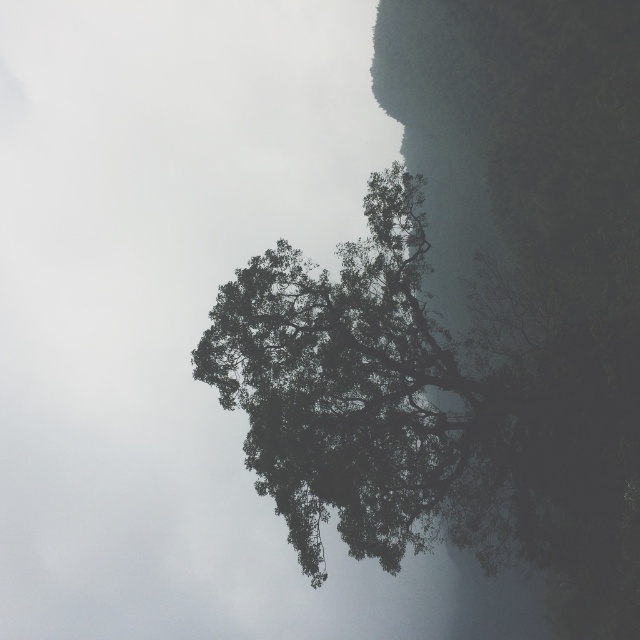
You are a hiker trying to navigate through the misty area. You see the dark green textured cliff at center and the dark green leafy tree at center. Which one is positioned to the right of the other?

The dark green textured cliff at center is to the right of the dark green leafy tree at center.

You are a hiker trying to reach the dark green leafy tree at center from the dark green textured cliff at center. Which direction should you move to get closer to the tree?

The dark green textured cliff at center is closer to you than the dark green leafy tree at center. To reach the tree, you should move away from the cliff towards the background.

You are a photographer trying to capture the tree in the misty scene. You want to place your camera so that the transparent fog at center is exactly in the middle of your viewfinder. Where should you position your camera relative to the tree?

The transparent fog at center is located at point coordinates of (164,307). To center it in the viewfinder, position your camera so that the fog is precisely at the midpoint of the frame, which corresponds to the coordinates provided.